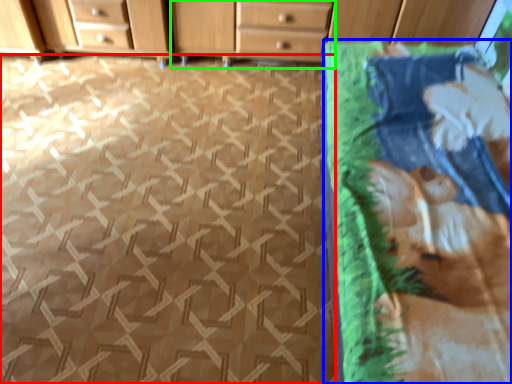
Question: Which is nearer to the tile (highlighted by a red box)? blanket (highlighted by a blue box) or chest of drawers (highlighted by a green box).

Choices:
 (A) blanket
 (B) chest of drawers

Answer: (A)